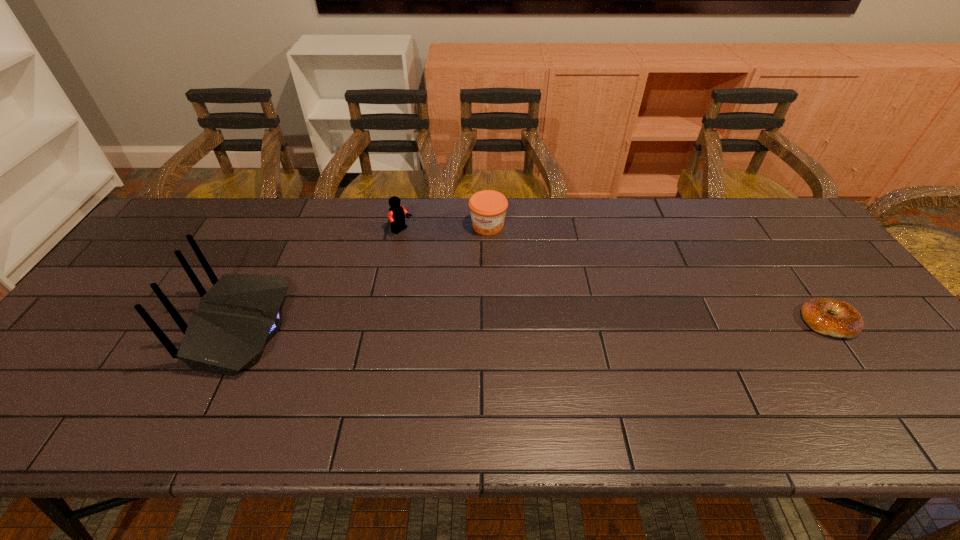
This screenshot has height=540, width=960. I want to click on vacant area that lies between the bagel and the third shortest object, so click(x=615, y=276).

Find the location of a particular element. unoccupied position between the third object from right to left and the shortest object is located at coordinates (615, 276).

Locate an element on the screen. The height and width of the screenshot is (540, 960). empty space between the tallest object and the second object from right to left is located at coordinates pos(365,276).

Identify the location of free spot between the jam and the Lego. This screenshot has height=540, width=960. (444, 229).

Where is `empty location between the Lego and the second shortest object`? This screenshot has height=540, width=960. empty location between the Lego and the second shortest object is located at coordinates (444, 229).

Where is `unoccupied position between the third shortest object and the third tallest object`? The image size is (960, 540). unoccupied position between the third shortest object and the third tallest object is located at coordinates (444, 229).

Identify the location of the closest object to the shortest object. (488, 208).

This screenshot has width=960, height=540. I want to click on object that is the second closest one to the Lego, so (240, 312).

This screenshot has height=540, width=960. In order to click on free space that satisfies the following two spatial constraints: 1. on the back side of the second tallest object; 2. on the left side of the jam in this screenshot , I will do `click(403, 226)`.